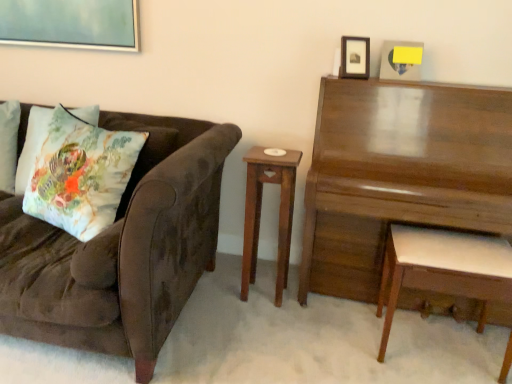
Question: In the image, is wooden picture frame at upper right, marked as the 2th picture frame in a right-to-left arrangement, positioned in front of or behind velvet brown couch at left?

Choices:
 (A) front
 (B) behind

Answer: (B)

Question: Is wooden picture frame at upper right, marked as the 2th picture frame in a right-to-left arrangement, taller or shorter than velvet brown couch at left?

Choices:
 (A) short
 (B) tall

Answer: (A)

Question: Which of these objects is positioned farthest from the wooden nightstand at center?

Choices:
 (A) wooden picture frame at upper right, marked as the first picture frame in a left-to-right arrangement
 (B) velvet brown couch at left
 (C) floral cotton cushion at left
 (D) white wood stool at right
 (E) floral fabric pillow at left

Answer: (E)

Question: Which is farther from the wooden nightstand at center?

Choices:
 (A) wooden picture frame at upper right, marked as the 2th picture frame in a right-to-left arrangement
 (B) white wood stool at right
 (C) glossy wood piano at upper right
 (D) floral fabric pillow at left
 (E) wooden picture frame at upper right, acting as the 1th picture frame starting from the right

Answer: (D)